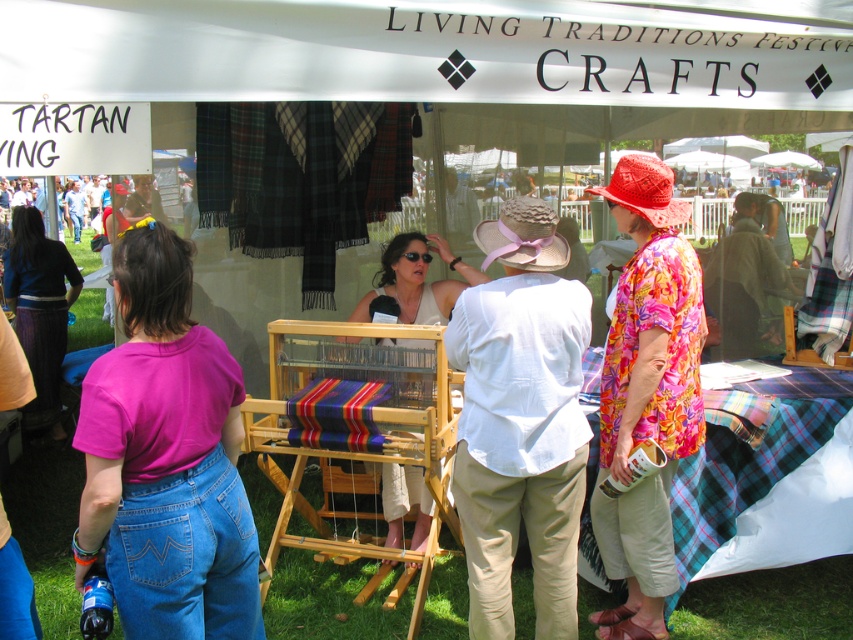
Based on the photo, does pink cotton shirt at center appear under floral fabric shirt at right?

Yes.

Who is more distant from viewer, (144,268) or (613,320)?

Point (613,320)

Is point (172, 374) positioned after point (630, 300)?

That is False.

I want to click on pink cotton shirt at center, so click(167, 458).

The width and height of the screenshot is (853, 640). Describe the element at coordinates (520, 420) in the screenshot. I see `white cotton hat at center` at that location.

Who is more distant from viewer, (532, 426) or (25, 342)?

Positioned behind is point (25, 342).

Between point (525, 248) and point (19, 340), which one is positioned in front?

Point (525, 248) is more forward.

Locate an element on the screen. This screenshot has width=853, height=640. white cotton hat at center is located at coordinates (520, 420).

Who is lower down, white cotton hat at center or floral fabric shirt at right?

white cotton hat at center

Where is `white cotton hat at center`? The image size is (853, 640). white cotton hat at center is located at coordinates (520, 420).